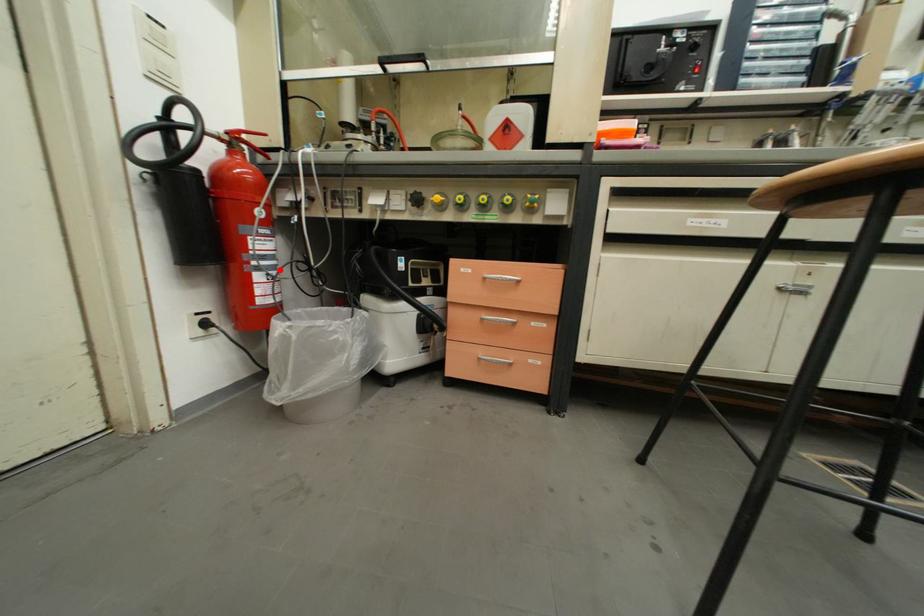
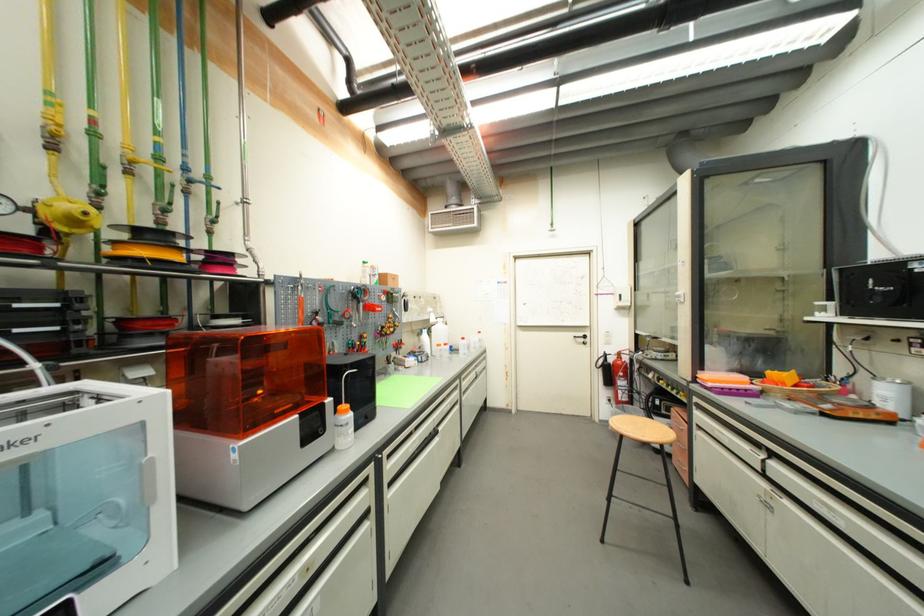
Question: A red point is marked in image1. In image2, is the corresponding 3D point closer to the camera or farther? Reply with the corresponding letter.

Choices:
 (A) The corresponding 3D point is closer.
 (B) The corresponding 3D point is farther.

Answer: (B)